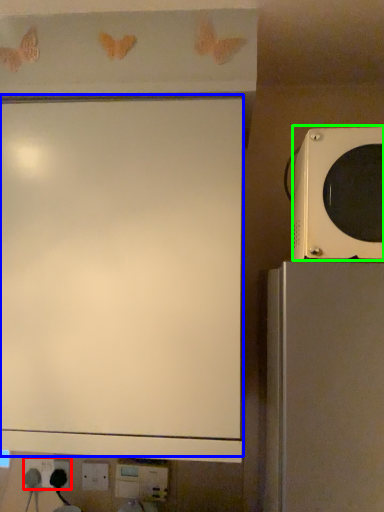
Question: Which object is the closest to the electric outlet (highlighted by a red box)? Choose among these: projection screen (highlighted by a blue box) or microwave oven (highlighted by a green box).

Choices:
 (A) projection screen
 (B) microwave oven

Answer: (A)